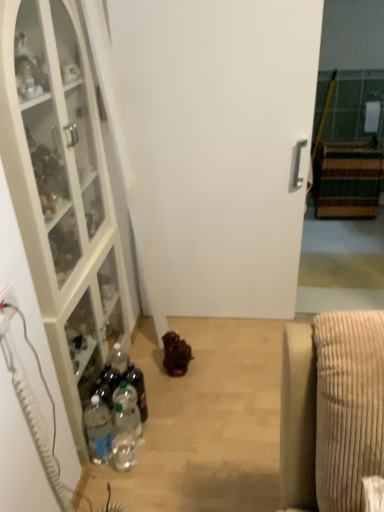
The width and height of the screenshot is (384, 512). Describe the element at coordinates (126, 410) in the screenshot. I see `clear plastic bottle at lower left, marked as the second bottle in a right-to-left arrangement` at that location.

What do you see at coordinates (348, 179) in the screenshot?
I see `striped carpet at right, the 1th cabinetry viewed from the back` at bounding box center [348, 179].

The height and width of the screenshot is (512, 384). I want to click on white glass cabinet at left, the 2th cabinetry when ordered from right to left, so click(62, 191).

Where is `white plastic electric outlet at lower left`? white plastic electric outlet at lower left is located at coordinates (7, 309).

Describe the element at coordinates (98, 430) in the screenshot. I see `clear plastic bottle at lower left, which is the 3th bottle from right to left` at that location.

Locate an element on the screen. The height and width of the screenshot is (512, 384). clear plastic bottle at lower left, the 2th bottle positioned from the left is located at coordinates (126, 410).

From a real-world perspective, between clear plastic bottle at lower left, which is the 1th bottle in left-to-right order, and white matte door at center, who is vertically lower?

From a 3D spatial view, clear plastic bottle at lower left, which is the 1th bottle in left-to-right order, is below.

Is clear plastic bottle at lower left, which is the 3th bottle from right to left, smaller than white matte door at center?

Indeed, clear plastic bottle at lower left, which is the 3th bottle from right to left, has a smaller size compared to white matte door at center.

How many degrees apart are the facing directions of clear plastic bottle at lower left, which is the 3th bottle from right to left, and white matte door at center?

There is a 90-degree angle between the facing directions of clear plastic bottle at lower left, which is the 3th bottle from right to left, and white matte door at center.

Between clear plastic bottle at lower left, which is the 3th bottle from right to left, and white matte door at center, which one is positioned behind?

Positioned behind is white matte door at center.

From a real-world perspective, which object stands above the other?

white matte door at center is physically above.

Does white matte door at center have a greater height compared to clear plastic bottle at center, the 1th bottle when ordered from right to left?

Indeed, white matte door at center has a greater height compared to clear plastic bottle at center, the 1th bottle when ordered from right to left.

Is white matte door at center next to clear plastic bottle at center, the 1th bottle when ordered from right to left, and touching it?

No, white matte door at center is not next to clear plastic bottle at center, the 1th bottle when ordered from right to left.

Is white matte door at center positioned behind clear plastic bottle at center, the 1th bottle when ordered from right to left?

No.

Is point (136, 410) farther from viewer compared to point (19, 134)?

Yes, it is.

From the image's perspective, which one is positioned lower, clear plastic bottle at lower left, marked as the second bottle in a right-to-left arrangement, or white glass cabinet at left, the 2th cabinetry when ordered from right to left?

clear plastic bottle at lower left, marked as the second bottle in a right-to-left arrangement, from the image's perspective.

This screenshot has height=512, width=384. Identify the location of the 1st cabinetry above the clear plastic bottle at lower left, the 2th bottle positioned from the left (from the image's perspective). (62, 191).

From a real-world perspective, is clear plastic bottle at lower left, marked as the second bottle in a right-to-left arrangement, under white glass cabinet at left, the 2th cabinetry when ordered from right to left?

Yes, from a real-world perspective, clear plastic bottle at lower left, marked as the second bottle in a right-to-left arrangement, is under white glass cabinet at left, the 2th cabinetry when ordered from right to left.

Is white matte door at center looking in the opposite direction of white plastic electric outlet at lower left?

white matte door at center is not turned away from white plastic electric outlet at lower left.

Which object is positioned more to the right, white matte door at center or white plastic electric outlet at lower left?

white matte door at center.

Is white matte door at center bigger than white plastic electric outlet at lower left?

Indeed, white matte door at center has a larger size compared to white plastic electric outlet at lower left.

Considering the positions of point (177, 119) and point (10, 309), is point (177, 119) closer or farther from the camera than point (10, 309)?

Point (177, 119) appears to be farther away from the viewer than point (10, 309).

Does clear plastic bottle at lower left, which is the 1th bottle in left-to-right order, turn towards clear plastic bottle at center, the 1th bottle when ordered from right to left?

No, clear plastic bottle at lower left, which is the 1th bottle in left-to-right order, is not facing towards clear plastic bottle at center, the 1th bottle when ordered from right to left.

Considering the positions of points (108, 433) and (138, 395), is point (108, 433) farther from camera compared to point (138, 395)?

No.

Which of these two, clear plastic bottle at lower left, which is the 3th bottle from right to left, or clear plastic bottle at center, the 3th bottle in the left-to-right sequence, stands taller?

With more height is clear plastic bottle at lower left, which is the 3th bottle from right to left.

From a real-world perspective, relative to white plastic electric outlet at lower left, is striped carpet at right, which ranks as the 1th cabinetry in right-to-left order, vertically above or below?

From a real-world perspective, striped carpet at right, which ranks as the 1th cabinetry in right-to-left order, is physically below white plastic electric outlet at lower left.

Locate an element on the screen. Image resolution: width=384 pixels, height=512 pixels. cabinetry that appears below the white plastic electric outlet at lower left (from a real-world perspective) is located at coordinates (348, 179).

From the image's perspective, which one is positioned higher, striped carpet at right, which ranks as the 2th cabinetry in left-to-right order, or white plastic electric outlet at lower left?

striped carpet at right, which ranks as the 2th cabinetry in left-to-right order.

How many degrees apart are the facing directions of striped carpet at right, positioned as the 2th cabinetry in front-to-back order, and white plastic electric outlet at lower left?

They differ by 89.4 degrees in their facing directions.

From the image's perspective, which object appears higher, clear plastic bottle at lower left, which is the 3th bottle from right to left, or clear plastic bottle at lower left, the 2th bottle positioned from the left?

clear plastic bottle at lower left, the 2th bottle positioned from the left, is shown above in the image.

From a real-world perspective, which object stands above the other?

From a 3D spatial view, clear plastic bottle at lower left, which is the 3th bottle from right to left, is above.

Between point (103, 457) and point (132, 414), which one is positioned behind?

Point (103, 457)

Does clear plastic bottle at lower left, which is the 3th bottle from right to left, have a greater height compared to clear plastic bottle at lower left, the 2th bottle positioned from the left?

Indeed, clear plastic bottle at lower left, which is the 3th bottle from right to left, has a greater height compared to clear plastic bottle at lower left, the 2th bottle positioned from the left.

There is a clear plastic bottle at lower left, which is the 3th bottle from right to left. Identify the location of door above it (from a real-world perspective). This screenshot has width=384, height=512. (219, 145).

From a real-world perspective, count 3rd bottles downward from the white matte door at center and point to it. Please provide its 2D coordinates.

[(137, 388)]

From the image, which object appears to be farther from clear plastic bottle at lower left, the 2th bottle positioned from the left, white glass cabinet at left, the 2th cabinetry when ordered from right to left, or clear plastic bottle at center, the 3th bottle in the left-to-right sequence?

Based on the image, white glass cabinet at left, the 2th cabinetry when ordered from right to left, appears to be further to clear plastic bottle at lower left, the 2th bottle positioned from the left.

When comparing their distances from white plastic electric outlet at lower left, does white matte door at center or striped carpet at right, which ranks as the 2th cabinetry in left-to-right order, seem closer?

Among the two, white matte door at center is located nearer to white plastic electric outlet at lower left.

Estimate the real-world distances between objects in this image. Which object is closer to striped carpet at right, positioned as the 2th cabinetry in front-to-back order, white plastic electric outlet at lower left or white glass cabinet at left, the 2th cabinetry when ordered from back to front?

Based on the image, white glass cabinet at left, the 2th cabinetry when ordered from back to front, appears to be nearer to striped carpet at right, positioned as the 2th cabinetry in front-to-back order.

Based on their spatial positions, is white glass cabinet at left, the 2th cabinetry when ordered from back to front, or white matte door at center further from clear plastic bottle at center, the 1th bottle when ordered from right to left?

Based on the image, white matte door at center appears to be further to clear plastic bottle at center, the 1th bottle when ordered from right to left.

Looking at this image, considering their positions, is clear plastic bottle at lower left, the 2th bottle positioned from the left, positioned closer to clear plastic bottle at center, the 1th bottle when ordered from right to left, than white matte door at center?

Among the two, clear plastic bottle at lower left, the 2th bottle positioned from the left, is located nearer to clear plastic bottle at center, the 1th bottle when ordered from right to left.

Looking at the image, which one is located closer to white glass cabinet at left, the 1th cabinetry positioned from the front, clear plastic bottle at center, the 3th bottle in the left-to-right sequence, or clear plastic bottle at lower left, which is the 1th bottle in left-to-right order?

clear plastic bottle at lower left, which is the 1th bottle in left-to-right order.

Estimate the real-world distances between objects in this image. Which object is further from clear plastic bottle at center, the 1th bottle when ordered from right to left, clear plastic bottle at lower left, which is the 1th bottle in left-to-right order, or white glass cabinet at left, which ranks as the first cabinetry in left-to-right order?

The object further to clear plastic bottle at center, the 1th bottle when ordered from right to left, is white glass cabinet at left, which ranks as the first cabinetry in left-to-right order.

Based on their spatial positions, is white matte door at center or white plastic electric outlet at lower left closer to striped carpet at right, the 1th cabinetry viewed from the back?

white matte door at center lies closer to striped carpet at right, the 1th cabinetry viewed from the back, than the other object.

At what (x,y) coordinates should I click in order to perform the action: click on electric outlet between white matte door at center and clear plastic bottle at center, the 3th bottle in the left-to-right sequence, vertically. Please return your answer as a coordinate pair (x, y). Looking at the image, I should click on (7, 309).

Locate an element on the screen. The height and width of the screenshot is (512, 384). electric outlet between white glass cabinet at left, the 2th cabinetry when ordered from right to left, and clear plastic bottle at center, the 3th bottle in the left-to-right sequence, in the vertical direction is located at coordinates (7, 309).

You are a GUI agent. You are given a task and a screenshot of the screen. Output one action in this format:
    pyautogui.click(x=<x>, y=<y>)
    Task: Click on the electric outlet between white matte door at center and clear plastic bottle at lower left, the 2th bottle positioned from the left, in the up-down direction
    
    Given the screenshot: What is the action you would take?
    pyautogui.click(x=7, y=309)

Where is `door between white glass cabinet at left, the 2th cabinetry when ordered from right to left, and clear plastic bottle at lower left, the 2th bottle positioned from the left, from top to bottom`? Image resolution: width=384 pixels, height=512 pixels. door between white glass cabinet at left, the 2th cabinetry when ordered from right to left, and clear plastic bottle at lower left, the 2th bottle positioned from the left, from top to bottom is located at coordinates (219, 145).